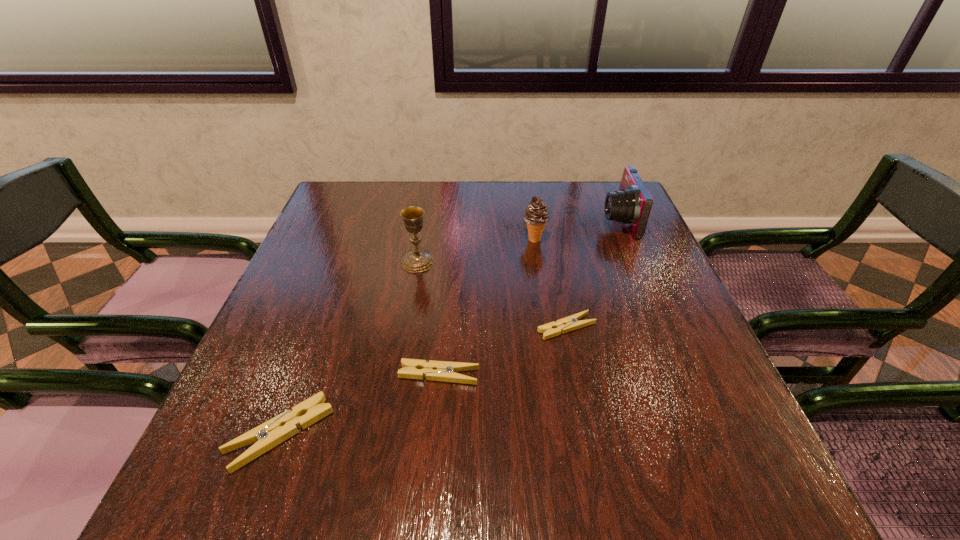
Image resolution: width=960 pixels, height=540 pixels. I want to click on vacant space positioned on the back of the second clothespin from right to left, so tap(450, 247).

Locate an element on the screen. vacant space located on the back of the farthest clothespin is located at coordinates (555, 268).

At what (x,y) coordinates should I click in order to perform the action: click on free location located 0.150m on the front of the icecream. Please return your answer as a coordinate pair (x, y). Looking at the image, I should click on (541, 285).

Locate an element on the screen. This screenshot has height=540, width=960. vacant position located 0.200m on the front-facing side of the camera is located at coordinates (530, 220).

The image size is (960, 540). In order to click on vacant area situated on the front-facing side of the camera in this screenshot , I will do `click(509, 220)`.

Where is `vacant space located 0.260m on the front-facing side of the camera`? This screenshot has width=960, height=540. vacant space located 0.260m on the front-facing side of the camera is located at coordinates (509, 220).

You are a GUI agent. You are given a task and a screenshot of the screen. Output one action in this format:
    pyautogui.click(x=<x>, y=<y>)
    Task: Click on the blank space located on the back of the fourth nearest object
    This screenshot has height=540, width=960.
    Given the screenshot: What is the action you would take?
    pyautogui.click(x=431, y=184)

Identify the location of object that is positioned at the far edge. The image size is (960, 540). (631, 205).

At what (x,y) coordinates should I click in order to perform the action: click on object positioned at the near edge. Please return your answer as a coordinate pair (x, y). This screenshot has height=540, width=960. Looking at the image, I should click on tap(268, 435).

Identify the location of object at the left edge. Image resolution: width=960 pixels, height=540 pixels. (268, 435).